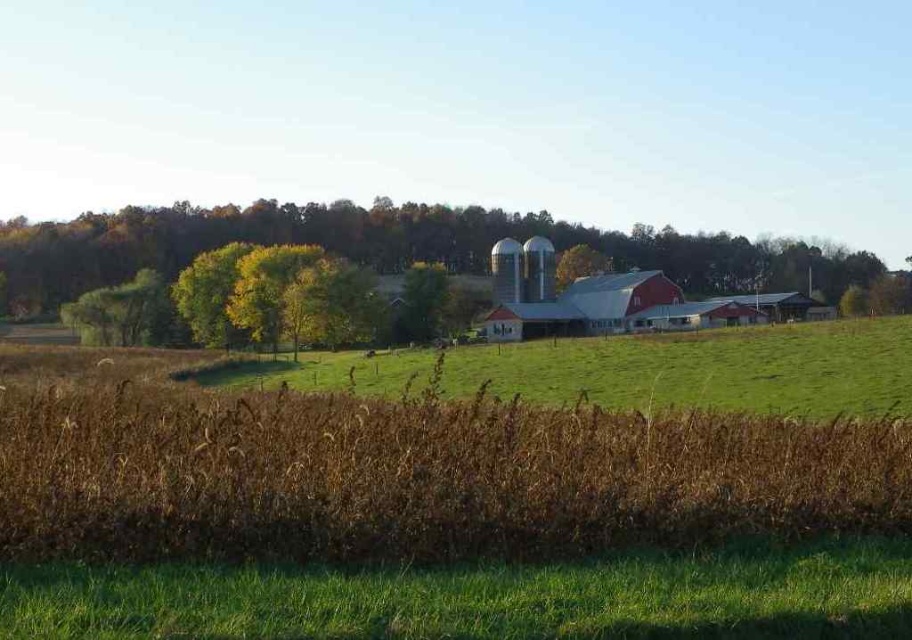
Is point (216, 209) positioned in front of point (573, 269)?

No, it is not.

Image resolution: width=912 pixels, height=640 pixels. Find the location of `green leafy tree at upper center`. green leafy tree at upper center is located at coordinates [x=392, y=246].

Is green leafy tree at upper center taller than green grassy field at center?

Correct, green leafy tree at upper center is much taller as green grassy field at center.

Can you confirm if green leafy tree at upper center is shorter than green grassy field at center?

In fact, green leafy tree at upper center may be taller than green grassy field at center.

Between point (30, 224) and point (767, 369), which one is positioned behind?

The point (30, 224) is more distant.

Where is `green leafy tree at upper center`? The width and height of the screenshot is (912, 640). green leafy tree at upper center is located at coordinates (392, 246).

You are a GUI agent. You are given a task and a screenshot of the screen. Output one action in this format:
    pyautogui.click(x=<x>, y=<y>)
    Task: Click on the green grassy field at center
    
    Given the screenshot: What is the action you would take?
    pyautogui.click(x=707, y=369)